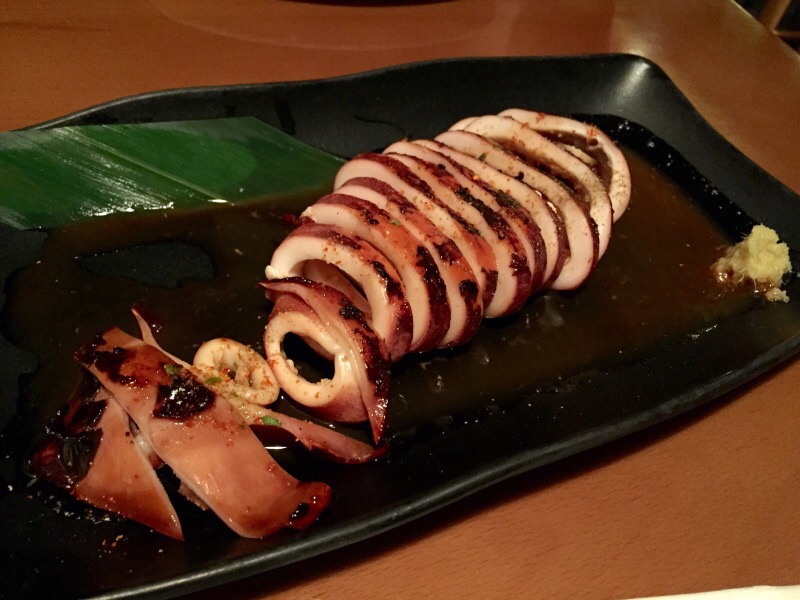
Locate an element on the screen. This screenshot has width=800, height=600. plate is located at coordinates (344, 94).